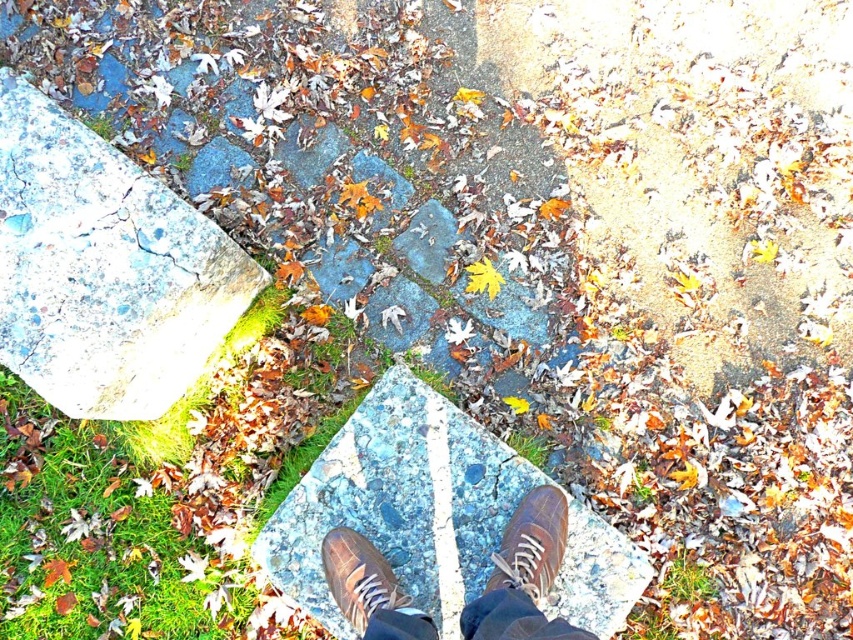
Question: Is green mossy stone at lower left above brown leather shoe at center?

Choices:
 (A) yes
 (B) no

Answer: (A)

Question: Is green mossy stone at lower left to the left of brown leather shoe at center from the viewer's perspective?

Choices:
 (A) yes
 (B) no

Answer: (A)

Question: Which point is farther from the camera taking this photo?

Choices:
 (A) (335, 577)
 (B) (219, 609)
 (C) (399, 609)

Answer: (B)

Question: Which of the following is the farthest from the observer?

Choices:
 (A) (497, 628)
 (B) (190, 413)

Answer: (B)

Question: Is green mossy stone at lower left above brown leather shoes at center?

Choices:
 (A) yes
 (B) no

Answer: (A)

Question: Based on their relative distances, which object is nearer to the green mossy stone at lower left?

Choices:
 (A) brown suede shoe at center
 (B) brown leather shoe at center
 (C) brown leather shoes at center

Answer: (A)